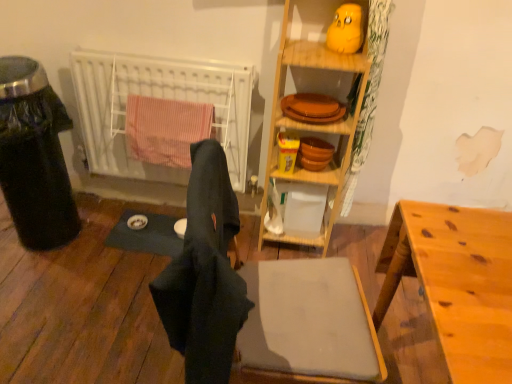
The image size is (512, 384). I want to click on free location above dark gray fabric yoga mat at center (from a real-world perspective), so click(x=147, y=227).